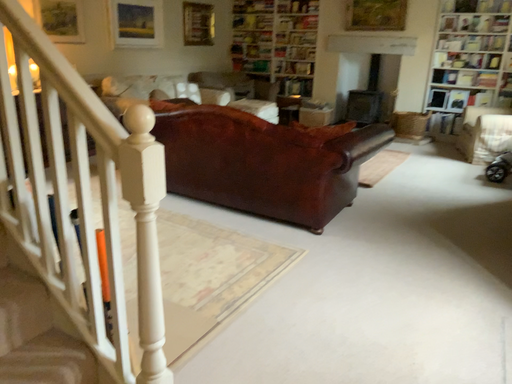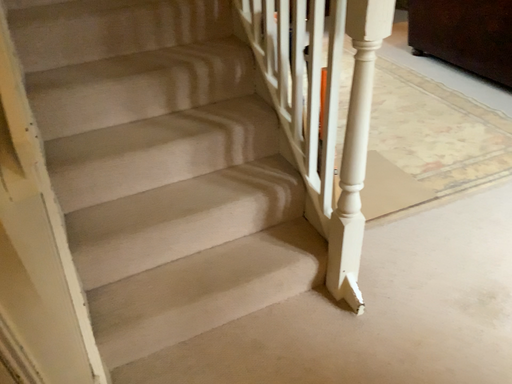
Question: How did the camera likely rotate when shooting the video?

Choices:
 (A) rotated left
 (B) rotated right

Answer: (A)